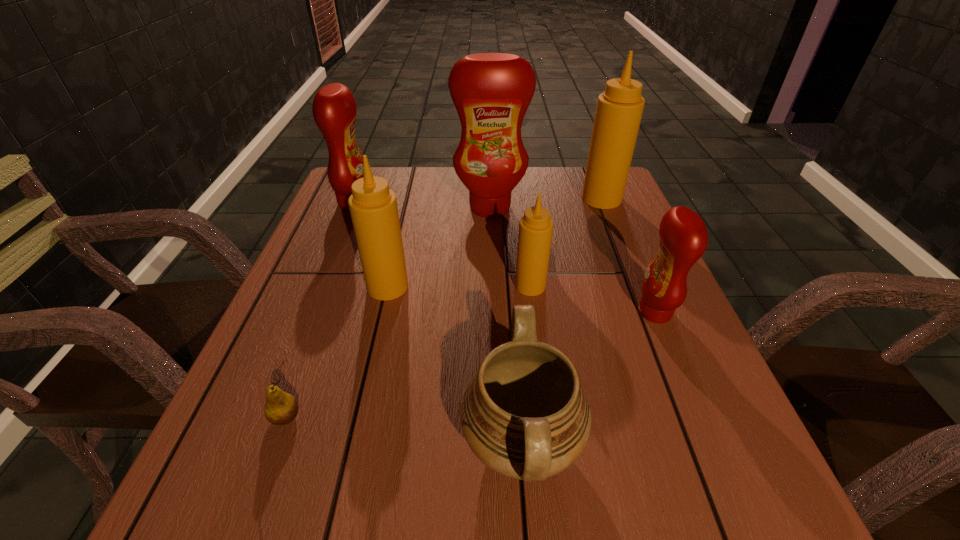
Find the location of a particular element. the third closest tan condiment to the shortest object is located at coordinates (619, 110).

Where is `blank space that satisfies the following two spatial constraints: 1. on the back side of the biggest tan condiment; 2. on the left side of the second tan condiment from right to left`? blank space that satisfies the following two spatial constraints: 1. on the back side of the biggest tan condiment; 2. on the left side of the second tan condiment from right to left is located at coordinates (519, 199).

Image resolution: width=960 pixels, height=540 pixels. In order to click on free spot that satisfies the following two spatial constraints: 1. on the front side of the rightmost tan condiment; 2. on the front-facing side of the urn in this screenshot , I will do `click(699, 444)`.